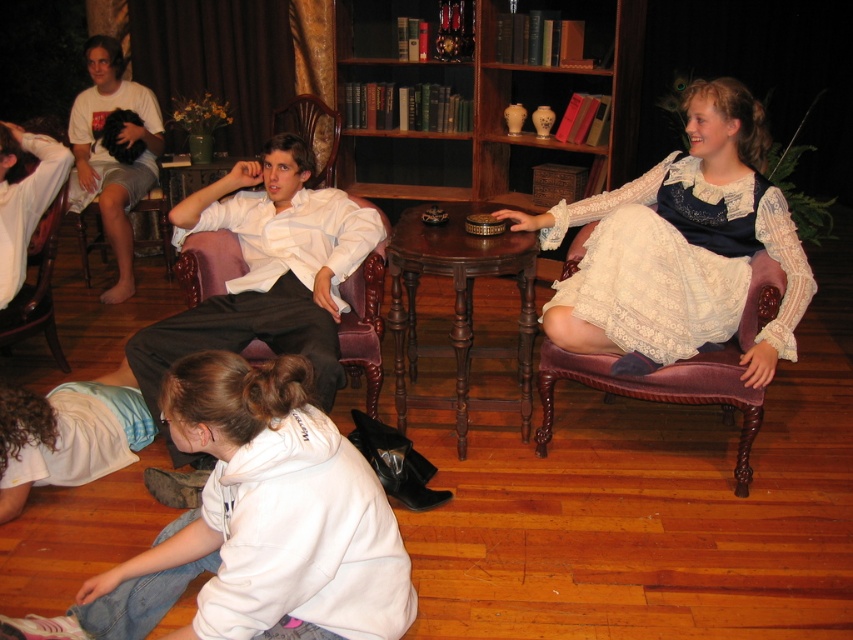
You are standing in the room and want to reach both the point at (358, 380) and the point at (22, 320). Which point should you reach for first if you want to touch the closer one?

You should reach for point (22, 320) first because it is closer to you than point (358, 380), which is further away.

What are the coordinates of the velvet purple armchair at right in the image?

The coordinates of the velvet purple armchair at right are at point (x=659, y=394).